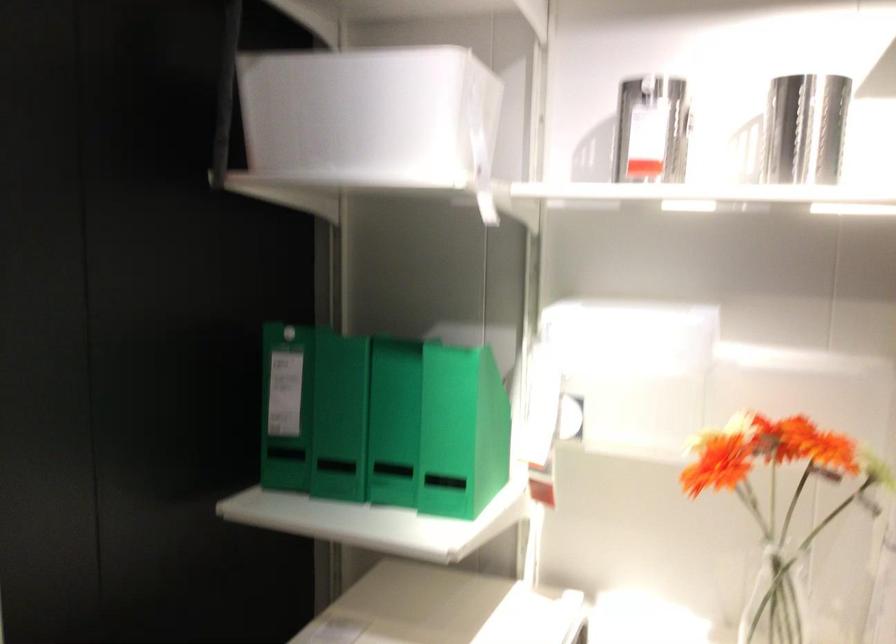
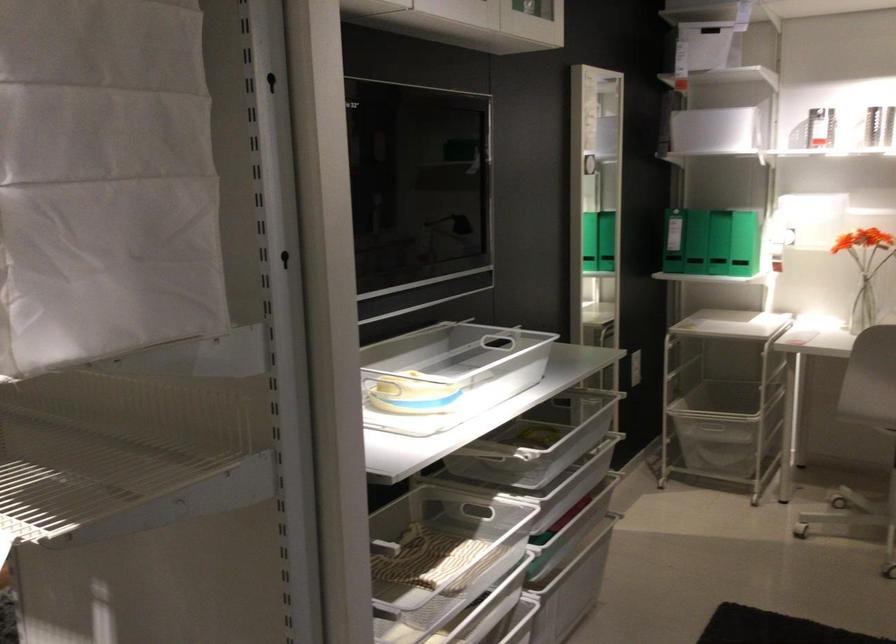
Where in the second image is the point corresponding to (x=329, y=169) from the first image?

(716, 133)